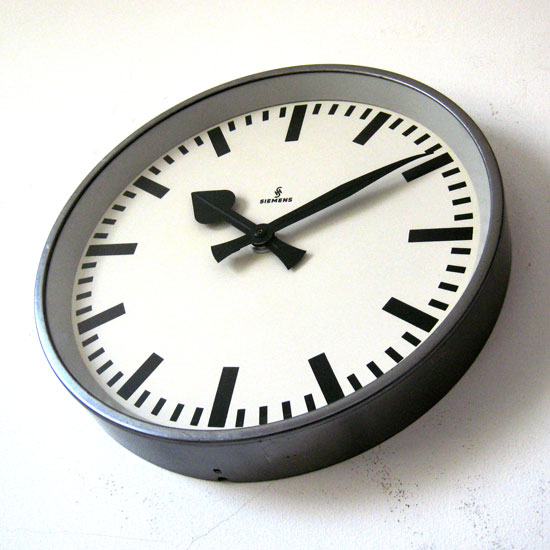
Where is `white wall`? Image resolution: width=550 pixels, height=550 pixels. white wall is located at coordinates (119, 66), (481, 405).